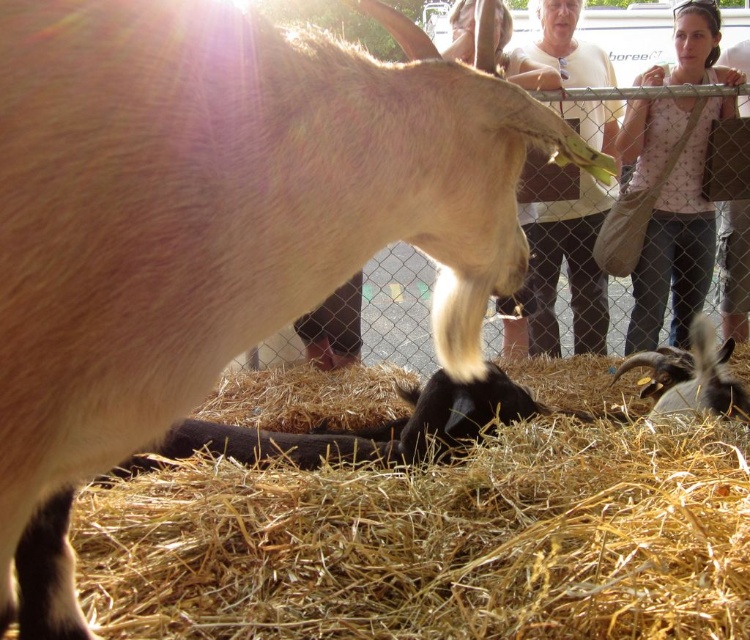
You are a photographer trying to capture a photo of the black fuzzy goat at lower right. There is a light beige sweater at upper center in the way. Can you move the sweater to the right to get a clear shot of the goat?

The light beige sweater at upper center is positioned on the left side of the black fuzzy goat at lower right, so moving it to the right would place it away from the goat, allowing for a clear shot.